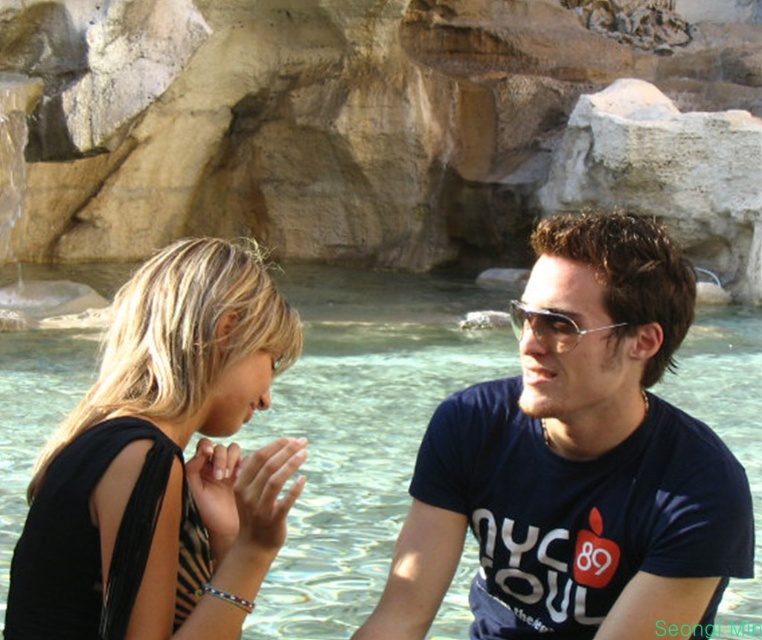
You are a photographer standing at the camera position and want to capture a closeup shot of the beige stone rock formation at upper center. Given that your camera can focus on objects up to 50 meters away, will you be able to take this photo without moving closer?

The beige stone rock formation at upper center is 57.86 meters from the camera. Since the camera can only focus up to 50 meters, you will need to move closer to take the closeup shot.

You are a photographer standing in front of the beige stone rock formation at upper center and the black fabric dress at left. Which object is closer to you?

The beige stone rock formation at upper center is closer to you because it is further to the viewer than the black fabric dress at left.